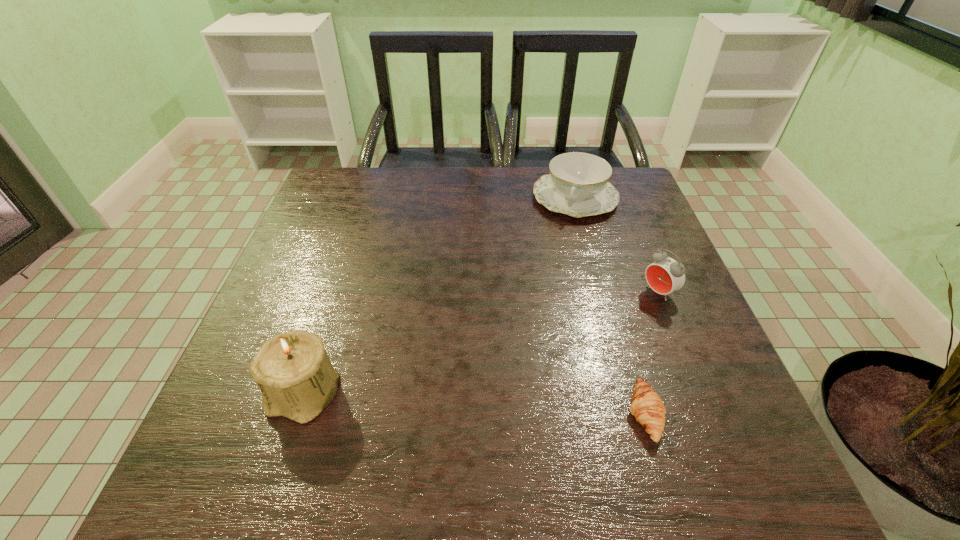
Where is `vacant space on the desktop that is between the candle_holder and the pastry and is positioned on the face of the third shortest object`? The image size is (960, 540). vacant space on the desktop that is between the candle_holder and the pastry and is positioned on the face of the third shortest object is located at coordinates (473, 403).

Locate an element on the screen. vacant space on the desktop that is between the tallest object and the shortest object and is positioned on the handle side of the chinaware is located at coordinates (504, 406).